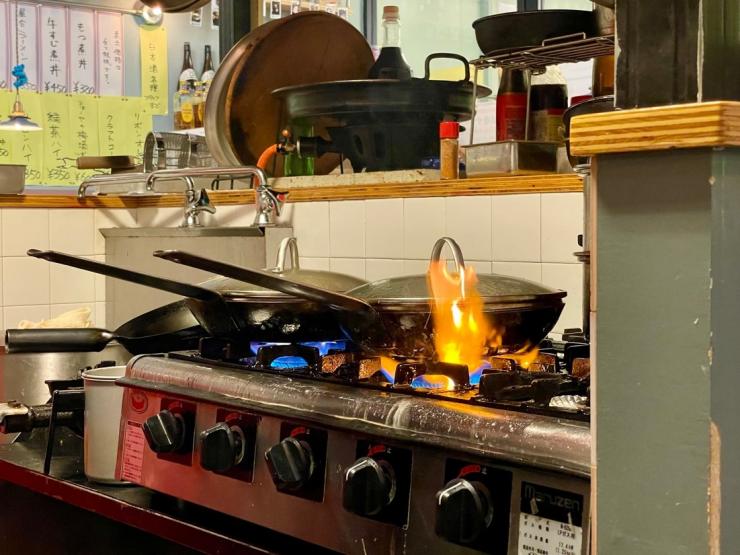
Locate an element on the screen. The height and width of the screenshot is (555, 740). tiles is located at coordinates (440, 228), (20, 304).